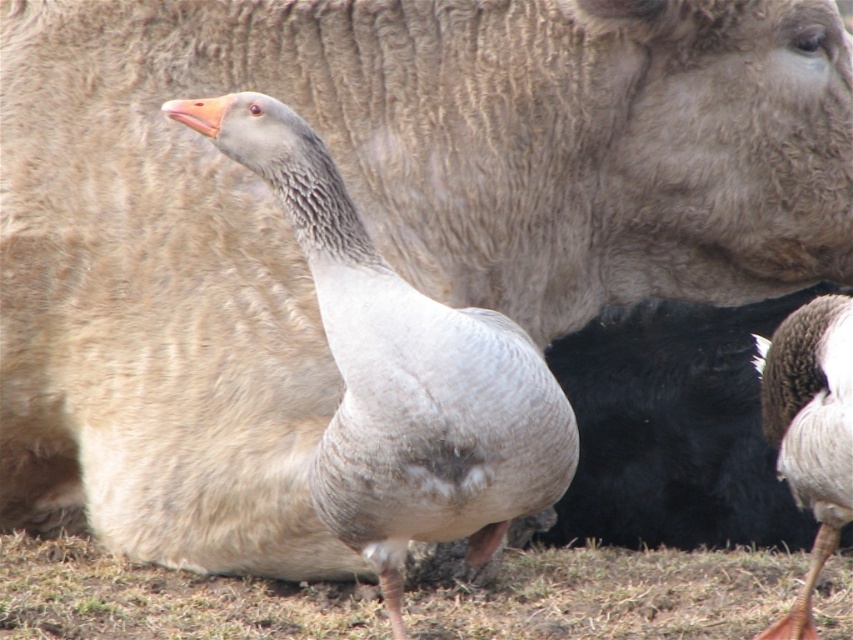
You are a wildlife photographer trying to capture a clear shot of both the gray downy duck at center and the gray feathered duck at center. Since you want to ensure both are in focus, you need to know which one is closer to the camera. Can you determine which duck is closer based on their sizes in the photo?

The gray downy duck at center is larger in size than the gray feathered duck at center, so it is closer to the camera since larger size in the photo typically indicates closer proximity.

You are a photographer trying to capture the gray downy duck at center and the green grass at lower center in a single shot. Based on their positions, which object is closer to the left edge of the frame?

The gray downy duck at center is to the left of the green grass at lower center, so it is closer to the left edge of the frame.

You are a photographer aiming to capture the gray feathered duck at center in your shot. You notice the green grass at lower center might obstruct the view. Based on their positions, can you determine if the grass is blocking the duck?

The green grass at lower center is below the gray feathered duck at center, so it is not blocking the duck as it is positioned underneath.